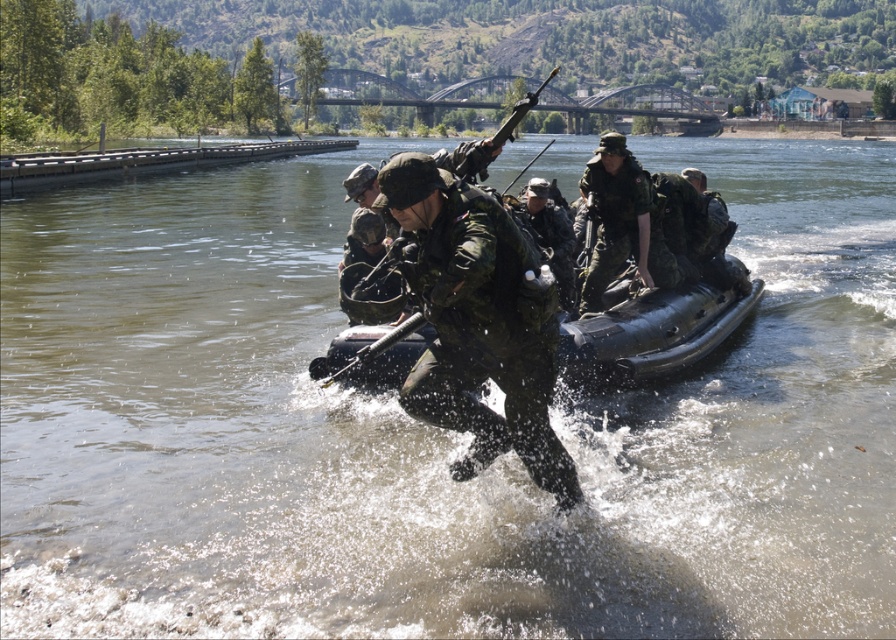
Based on the photo, you are a drone operator controlling a surveillance drone. You need to determine if the camouflage fabric soldier at center is within the 10 meter operational range of your drone. Can you confirm?

The camouflage fabric soldier at center is 7.91 meters away from the viewer, which is within the 10 meter operational range of the drone. Yes, the drone can operate effectively within this distance.

Based on the scene description, which soldier is positioned lower in the image, the camouflage fabric soldier at center or the matte green uniform at center?

The camouflage fabric soldier at center is positioned lower than the matte green uniform at center according to the description.

You are a military planner assessing the river crossing. The black rubber boat at center and the green matte uniform at center are both in the center of the image. Which object is wider?

The black rubber boat at center is wider than the green matte uniform at center.